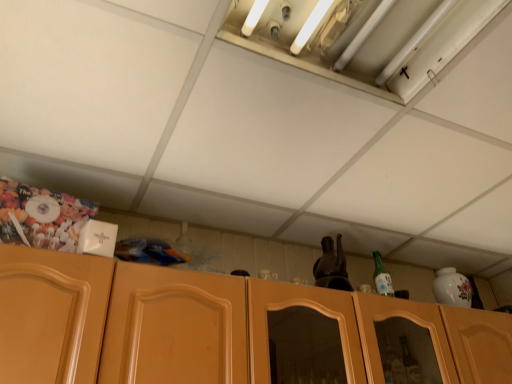
Locate an element on the screen. wooden cabinet at center is located at coordinates (227, 329).

What do you see at coordinates (227, 329) in the screenshot? I see `wooden cabinet at center` at bounding box center [227, 329].

Measure the distance between point (2, 341) and camera.

They are 37.91 inches apart.

Locate an element on the screen. The image size is (512, 384). wooden cabinet at center is located at coordinates (227, 329).